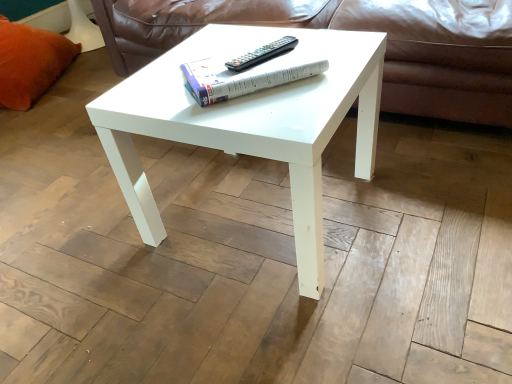
This screenshot has height=384, width=512. I want to click on vacant space to the right of white glossy coffee table at center, so click(x=417, y=195).